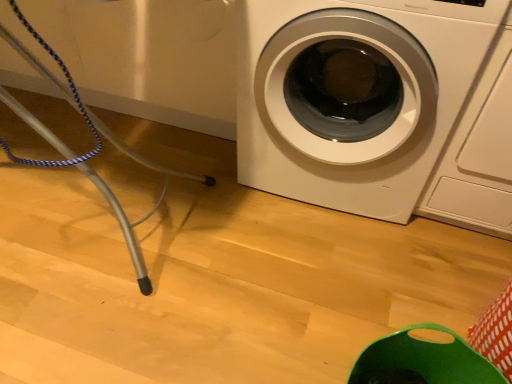
This screenshot has width=512, height=384. I want to click on white glossy washing machine at lower right, so click(354, 96).

Describe the element at coordinates (354, 96) in the screenshot. I see `white glossy washing machine at lower right` at that location.

This screenshot has width=512, height=384. What are the coordinates of `white glossy washing machine at lower right` in the screenshot? It's located at tap(354, 96).